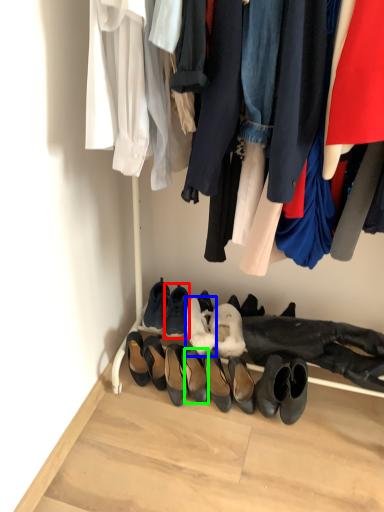
Question: Considering the real-world distances, which object is closest to footwear (highlighted by a red box)? shoe (highlighted by a blue box) or footwear (highlighted by a green box).

Choices:
 (A) shoe
 (B) footwear

Answer: (A)